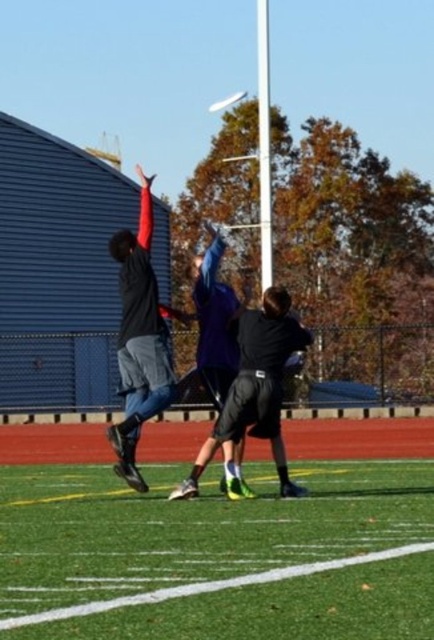
You are a photographer standing at the edge of the field. You want to capture a photo where the green artificial turf at center is visible behind the black matte shorts at center. Is this possible given their positions?

Yes, the green artificial turf at center is located below the black matte shorts at center, so it can be seen behind them in the photo.

You are a soccer player who just kicked a ball and it rolled towards the green artificial turf at center and the black matte shorts at center. Which surface will the ball stop on first?

The ball will stop on the green artificial turf at center first because it has a lesser height compared to the black matte shorts at center, meaning it is lower and the ball would naturally roll to the lower surface first.

You are standing at the point marked as point [265,474] on the field. The frisbee is currently 12.71 meters away from you. Can you throw the frisbee to a teammate who is 15 meters away from you? Please explain your reasoning.

The distance between you and the teammate is 15 meters, which is greater than the 12.71 meters you can throw. Therefore, you cannot reach them with this throw.